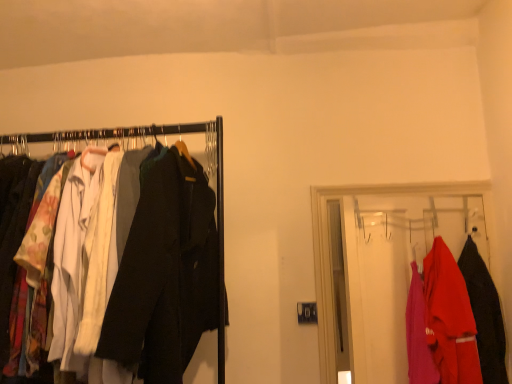
Question: Considering the relative positions of matte red shirt at right, which is the 2th fancy dress in right-to-left order, and matte black coat at right, marked as the 2th fancy dress in a left-to-right arrangement, in the image provided, is matte red shirt at right, which is the 2th fancy dress in right-to-left order, in front of matte black coat at right, marked as the 2th fancy dress in a left-to-right arrangement,?

Choices:
 (A) yes
 (B) no

Answer: (A)

Question: Is matte red shirt at right, the 1th fancy dress from the left, far away from matte black coat at right, marked as the 2th fancy dress in a left-to-right arrangement?

Choices:
 (A) no
 (B) yes

Answer: (A)

Question: Does matte red shirt at right, which is the 2th fancy dress in right-to-left order, have a greater height compared to matte black coat at right, marked as the 2th fancy dress in a left-to-right arrangement?

Choices:
 (A) no
 (B) yes

Answer: (A)

Question: Is matte red shirt at right, which is the 2th fancy dress in right-to-left order, touching matte black coat at right, marked as the 2th fancy dress in a left-to-right arrangement?

Choices:
 (A) no
 (B) yes

Answer: (A)

Question: From a real-world perspective, is matte red shirt at right, which is the 2th fancy dress in right-to-left order, positioned under matte black coat at right, marked as the 2th fancy dress in a left-to-right arrangement, based on gravity?

Choices:
 (A) no
 (B) yes

Answer: (B)

Question: Is matte red shirt at right, which is the 2th fancy dress in right-to-left order, located outside matte black coat at right, marked as the 2th fancy dress in a left-to-right arrangement?

Choices:
 (A) yes
 (B) no

Answer: (A)

Question: Can we say matte plastic hanger at right, arranged as the second closet when viewed from the left, lies outside matte black coat at right, the 1th fancy dress viewed from the right?

Choices:
 (A) no
 (B) yes

Answer: (B)

Question: Is matte plastic hanger at right, arranged as the 1th closet when viewed from the right, positioned in front of matte black coat at right, the 1th fancy dress viewed from the right?

Choices:
 (A) no
 (B) yes

Answer: (B)

Question: Does matte plastic hanger at right, arranged as the second closet when viewed from the left, have a smaller size compared to matte black coat at right, the 1th fancy dress viewed from the right?

Choices:
 (A) no
 (B) yes

Answer: (A)

Question: Is matte black coat at right, the 1th fancy dress viewed from the right, at the back of matte plastic hanger at right, arranged as the 1th closet when viewed from the right?

Choices:
 (A) no
 (B) yes

Answer: (B)

Question: Does matte plastic hanger at right, arranged as the 1th closet when viewed from the right, appear on the right side of matte black coat at right, the 1th fancy dress viewed from the right?

Choices:
 (A) no
 (B) yes

Answer: (A)

Question: Would you say matte black coat at right, the 1th fancy dress viewed from the right, is part of matte plastic hanger at right, arranged as the 1th closet when viewed from the right,'s contents?

Choices:
 (A) yes
 (B) no

Answer: (A)

Question: Is matte black coat rack at left, positioned as the 2th closet in right-to-left order, smaller than matte plastic hanger at right, arranged as the 1th closet when viewed from the right?

Choices:
 (A) yes
 (B) no

Answer: (B)